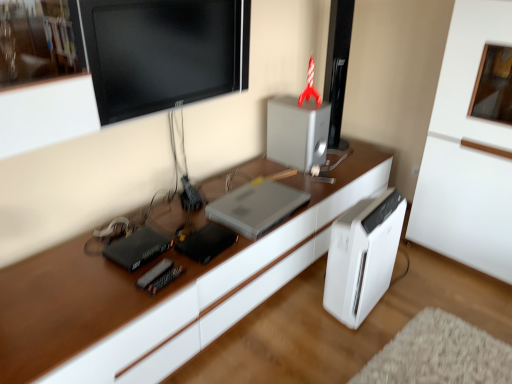
Question: Is satin silver speaker at upper center, placed as the 1th appliance when sorted from back to front, positioned beyond the bounds of black glossy monitor at upper center?

Choices:
 (A) yes
 (B) no

Answer: (A)

Question: From the image's perspective, is satin silver speaker at upper center, which ranks as the 2th appliance in front-to-back order, located beneath black glossy monitor at upper center?

Choices:
 (A) no
 (B) yes

Answer: (B)

Question: Is satin silver speaker at upper center, the 2th appliance when ordered from bottom to top, shorter than black glossy monitor at upper center?

Choices:
 (A) yes
 (B) no

Answer: (A)

Question: Considering the relative positions of satin silver speaker at upper center, which ranks as the first appliance in top-to-bottom order, and black glossy monitor at upper center in the image provided, is satin silver speaker at upper center, which ranks as the first appliance in top-to-bottom order, to the right of black glossy monitor at upper center from the viewer's perspective?

Choices:
 (A) yes
 (B) no

Answer: (A)

Question: Can you confirm if satin silver speaker at upper center, placed as the first appliance when sorted from right to left, is smaller than black glossy monitor at upper center?

Choices:
 (A) yes
 (B) no

Answer: (A)

Question: From a real-world perspective, is satin silver speaker at upper center, placed as the first appliance when sorted from right to left, on top of black glossy monitor at upper center?

Choices:
 (A) yes
 (B) no

Answer: (B)

Question: From a real-world perspective, is black glossy monitor at upper center located higher than white glossy desk at center?

Choices:
 (A) no
 (B) yes

Answer: (B)

Question: Is black glossy monitor at upper center next to white glossy desk at center?

Choices:
 (A) no
 (B) yes

Answer: (A)

Question: Is the depth of black glossy monitor at upper center greater than that of white glossy desk at center?

Choices:
 (A) no
 (B) yes

Answer: (B)

Question: From the image's perspective, is black glossy monitor at upper center on white glossy desk at center?

Choices:
 (A) no
 (B) yes

Answer: (B)

Question: Is black glossy monitor at upper center shorter than white glossy desk at center?

Choices:
 (A) yes
 (B) no

Answer: (B)

Question: Is black glossy monitor at upper center aimed at white glossy desk at center?

Choices:
 (A) no
 (B) yes

Answer: (A)

Question: Can you confirm if black plastic router at left, placed as the 2th appliance when sorted from back to front, is wider than black glossy monitor at upper center?

Choices:
 (A) no
 (B) yes

Answer: (B)